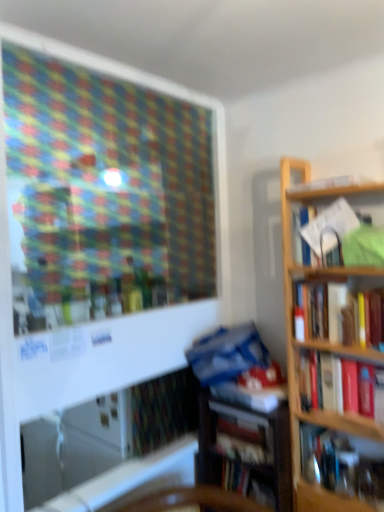
Question: Does white paper at upper right, which is counted as the 6th book, starting from the bottom, contain hardcover book at upper right, which appears as the 1th book when viewed from the top?

Choices:
 (A) yes
 (B) no

Answer: (B)

Question: Considering the relative positions of white paper at upper right, the 2th book viewed from the top, and hardcover book at upper right, which appears as the 1th book when viewed from the top, in the image provided, is white paper at upper right, the 2th book viewed from the top, to the right of hardcover book at upper right, which appears as the 1th book when viewed from the top, from the viewer's perspective?

Choices:
 (A) no
 (B) yes

Answer: (A)

Question: Can you confirm if white paper at upper right, which is counted as the 6th book, starting from the bottom, is thinner than hardcover book at upper right, which appears as the seventh book when ordered from the bottom?

Choices:
 (A) no
 (B) yes

Answer: (A)

Question: Is white paper at upper right, which is counted as the 6th book, starting from the bottom, positioned far away from hardcover book at upper right, which appears as the seventh book when ordered from the bottom?

Choices:
 (A) yes
 (B) no

Answer: (B)

Question: Considering the relative sizes of white paper at upper right, which is counted as the 6th book, starting from the bottom, and hardcover book at upper right, which appears as the seventh book when ordered from the bottom, in the image provided, is white paper at upper right, which is counted as the 6th book, starting from the bottom, wider than hardcover book at upper right, which appears as the seventh book when ordered from the bottom,?

Choices:
 (A) yes
 (B) no

Answer: (A)

Question: From a real-world perspective, is white paper at upper right, the 2th book viewed from the top, positioned over hardcover book at upper right, which appears as the seventh book when ordered from the bottom, based on gravity?

Choices:
 (A) no
 (B) yes

Answer: (A)

Question: Could you tell me if hardcover book at right, the 4th book when ordered from bottom to top, is turned towards hardcover book at right, which is counted as the 5th book, starting from the bottom?

Choices:
 (A) no
 (B) yes

Answer: (A)

Question: Considering the relative sizes of hardcover book at right, positioned as the fourth book in top-to-bottom order, and hardcover book at right, positioned as the 3th book in top-to-bottom order, in the image provided, is hardcover book at right, positioned as the fourth book in top-to-bottom order, taller than hardcover book at right, positioned as the 3th book in top-to-bottom order,?

Choices:
 (A) yes
 (B) no

Answer: (A)

Question: Is hardcover book at right, the 4th book when ordered from bottom to top, surrounding hardcover book at right, positioned as the 3th book in top-to-bottom order?

Choices:
 (A) no
 (B) yes

Answer: (A)

Question: Are hardcover book at right, the 4th book when ordered from bottom to top, and hardcover book at right, which is counted as the 5th book, starting from the bottom, far apart?

Choices:
 (A) yes
 (B) no

Answer: (B)

Question: Considering the relative sizes of hardcover book at right, positioned as the fourth book in top-to-bottom order, and hardcover book at right, which is counted as the 5th book, starting from the bottom, in the image provided, is hardcover book at right, positioned as the fourth book in top-to-bottom order, smaller than hardcover book at right, which is counted as the 5th book, starting from the bottom,?

Choices:
 (A) yes
 (B) no

Answer: (B)

Question: Is hardcover book at right, the 4th book when ordered from bottom to top, wider than hardcover book at right, which is counted as the 5th book, starting from the bottom?

Choices:
 (A) yes
 (B) no

Answer: (A)

Question: Are white paper at upper right, which is counted as the 6th book, starting from the bottom, and blue matte book at center, which is the 5th book from top to bottom, far apart?

Choices:
 (A) no
 (B) yes

Answer: (A)